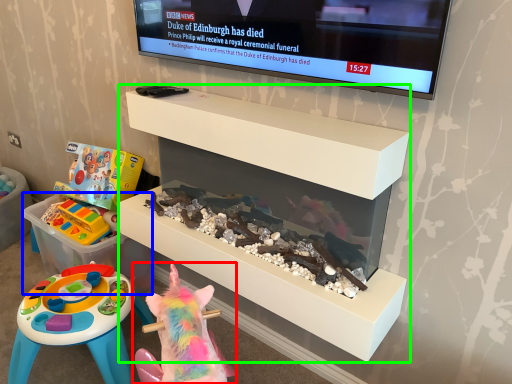
Question: Which is farther away from toy (highlighted by a red box)? storage box (highlighted by a blue box) or furniture (highlighted by a green box)?

Choices:
 (A) storage box
 (B) furniture

Answer: (A)